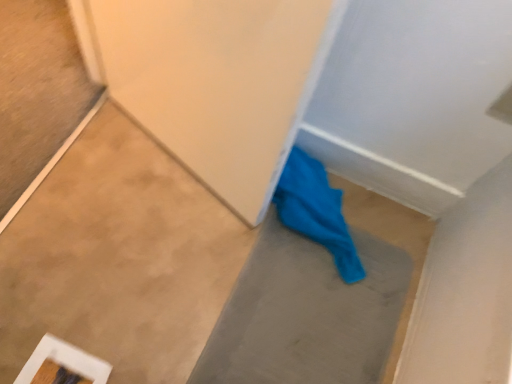
The height and width of the screenshot is (384, 512). In order to click on blue fabric at lower center in this screenshot , I will do `click(321, 301)`.

Describe the element at coordinates (321, 301) in the screenshot. This screenshot has height=384, width=512. I see `blue fabric at lower center` at that location.

Image resolution: width=512 pixels, height=384 pixels. What are the coordinates of `blue fabric at lower center` in the screenshot? It's located at click(x=321, y=301).